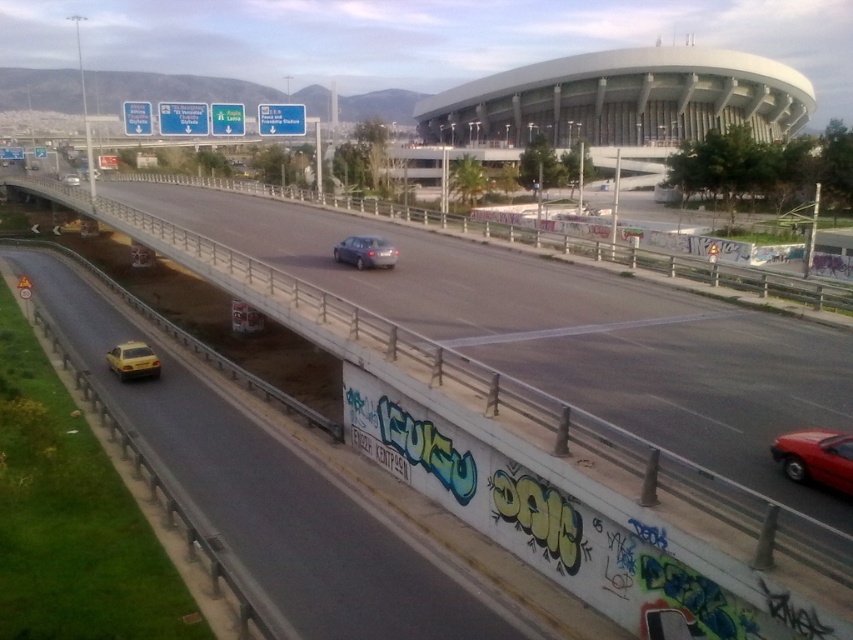
You are a photographer planning to capture the white concrete stadium at upper center and the satin silver sedan at center in a single frame. Based on their relative sizes, which object will appear larger in the photo?

The white concrete stadium at upper center will appear larger in the photo because its width surpasses that of the satin silver sedan at center.

You are a traffic controller observing the highway. You notice a satin silver sedan at center and a yellow matte taxi at lower left. Which vehicle is blocking the other one from moving forward?

The satin silver sedan at center is positioned over yellow matte taxi at lower left, meaning the sedan is blocking the taxi from moving forward.

You are a pedestrian standing on the grassy area on the left side of the highway. You see the satin silver sedan at center and the yellow matte taxi at lower left. Which vehicle is nearer to you?

The satin silver sedan at center is closer to the viewer than the yellow matte taxi at lower left, so the satin silver sedan at center is nearer to you.